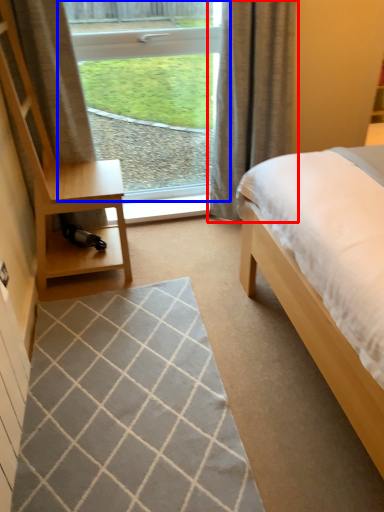
Question: Which object appears closest to the camera in this image, curtain (highlighted by a red box) or window (highlighted by a blue box)?

Choices:
 (A) curtain
 (B) window

Answer: (A)